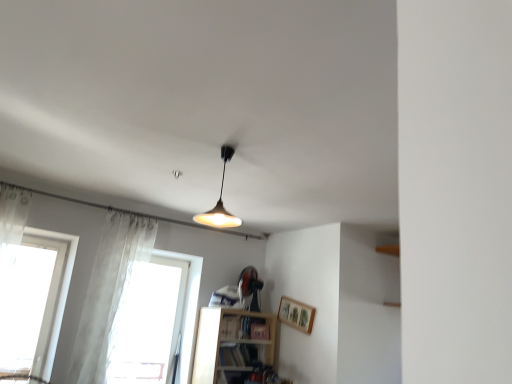
Question: From a real-world perspective, relative to translucent fabric curtain at left, is white glass window at left, the 2th window positioned from the right, vertically above or below?

Choices:
 (A) above
 (B) below

Answer: (B)

Question: In the image, is white glass window at left, the 2th window positioned from the right, positioned in front of or behind translucent fabric curtain at left?

Choices:
 (A) front
 (B) behind

Answer: (A)

Question: Which is nearer to the translucent fabric curtain at left?

Choices:
 (A) transparent fabric at lower left, which ranks as the second window in left-to-right order
 (B) white glass window at left, the 2th window positioned from the right
 (C) hardcover book at lower center, the second book positioned from the top
 (D) metallic silver fan at center
 (E) wooden at lower center

Answer: (B)

Question: Estimate the real-world distances between objects in this image. Which object is farther from the matte black bookshelf at lower center, the 1th book in the top-to-bottom sequence?

Choices:
 (A) wooden framed picture at upper right
 (B) matte gold pendant light at center
 (C) translucent fabric curtain at left
 (D) transparent fabric at lower left, which ranks as the second window in left-to-right order
 (E) white glass window at left, the 2th window positioned from the right

Answer: (E)